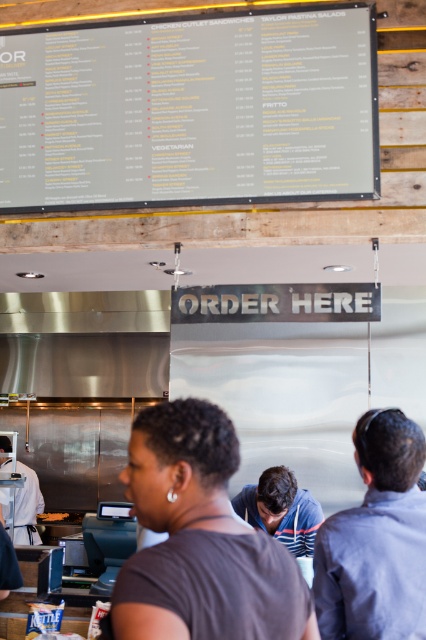
You are a customer in a deli and want to order fries. You see both the dark brown hair at center and the golden crispy fries at center. Which one is larger in size?

The dark brown hair at center is bigger than golden crispy fries at center.

You are a customer standing at the entrance of the deli. You see two points in the image, one at coordinate point (169,204) and another at point (411,541). Which point is closer to you?

Point (169,204) is further to the camera than point (411,541). Therefore, the point closer to you is point (411,541).

You are a customer standing in the deli and want to order a sandwich. The dark brown hair at center is blocking your view of the menu board. Can you step forward to see the menu board better?

The dark brown hair at center is 3.53 feet away from you, so stepping forward would allow you to see the menu board better by moving past the obstruction.